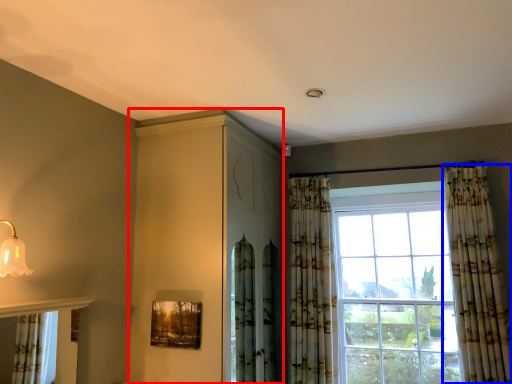
Question: Which point is closer to the camera, dresser (highlighted by a red box) or curtain (highlighted by a blue box)?

Choices:
 (A) dresser
 (B) curtain

Answer: (A)